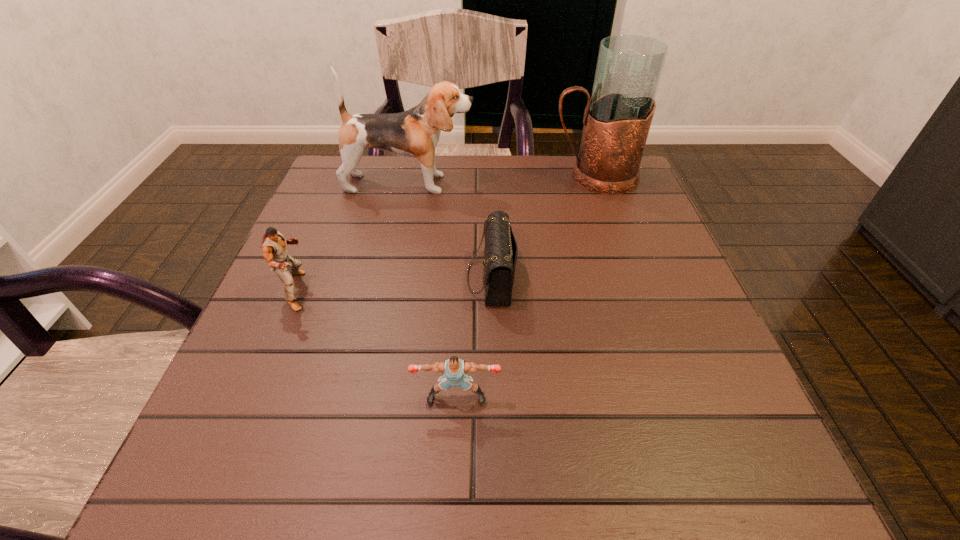
At what (x,y) coordinates should I click in order to perform the action: click on object located in the right edge section of the desktop. Please return your answer as a coordinate pair (x, y). Looking at the image, I should click on (617, 119).

The width and height of the screenshot is (960, 540). Find the location of `object present at the far left corner`. object present at the far left corner is located at coordinates (415, 133).

This screenshot has height=540, width=960. I want to click on object at the far right corner, so click(617, 119).

This screenshot has height=540, width=960. In the image, there is a desktop. Find the location of `vacant space at the far edge`. vacant space at the far edge is located at coordinates (539, 200).

You are a GUI agent. You are given a task and a screenshot of the screen. Output one action in this format:
    pyautogui.click(x=<x>, y=<y>)
    Task: Click on the vacant space at the near edge of the desktop
    
    Given the screenshot: What is the action you would take?
    pyautogui.click(x=344, y=495)

Locate an element on the screen. vacant region at the left edge is located at coordinates (306, 356).

Where is `vacant area at the right edge`? vacant area at the right edge is located at coordinates (587, 222).

At what (x,y) coordinates should I click in order to perform the action: click on unoccupied position between the pitcher and the right puncher. Please return your answer as a coordinate pair (x, y). Image resolution: width=960 pixels, height=540 pixels. Looking at the image, I should click on (525, 287).

What are the coordinates of `vacant area that lies between the clutch bag and the left puncher` in the screenshot? It's located at (394, 284).

Find the location of a particular element. This screenshot has height=540, width=960. vacant point located between the taller puncher and the puppy is located at coordinates (352, 237).